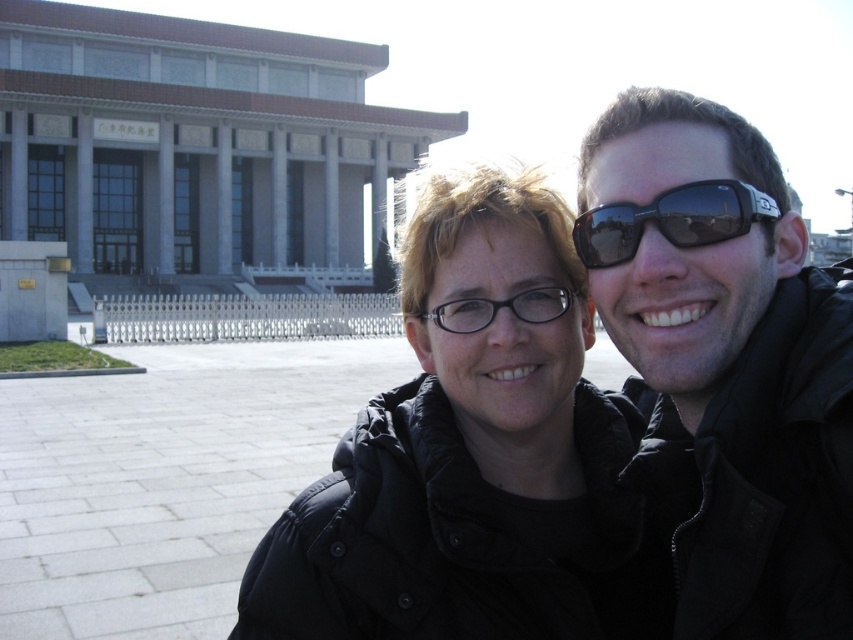
Question: Is black matte jacket at center further to camera compared to black matte jacket at upper right?

Choices:
 (A) no
 (B) yes

Answer: (B)

Question: Observing the image, what is the correct spatial positioning of black matte jacket at center in reference to black matte jacket at upper right?

Choices:
 (A) right
 (B) left

Answer: (B)

Question: Which is nearer to the black matte jacket at center?

Choices:
 (A) sunglasses at center
 (B) black matte jacket at upper right
 (C) black plastic glasses at center

Answer: (C)

Question: Does black matte jacket at upper right come behind black plastic glasses at center?

Choices:
 (A) no
 (B) yes

Answer: (A)

Question: Which of the following is the closest to the observer?

Choices:
 (A) sunglasses at center
 (B) black matte jacket at upper right

Answer: (B)

Question: Which point is closer to the camera taking this photo?

Choices:
 (A) (477, 330)
 (B) (805, 548)
 (C) (440, 300)
 (D) (779, 212)

Answer: (B)